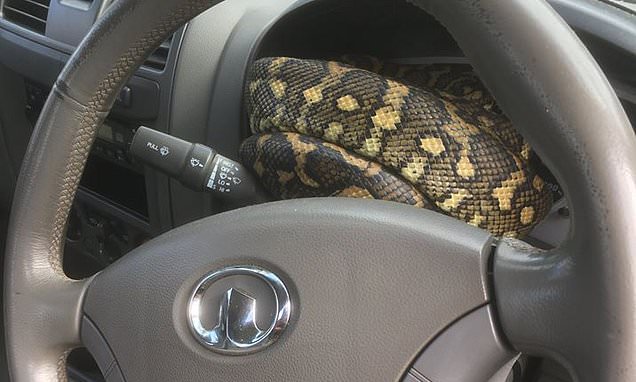
The height and width of the screenshot is (382, 636). Identify the location of air vent. (25, 11), (154, 54).